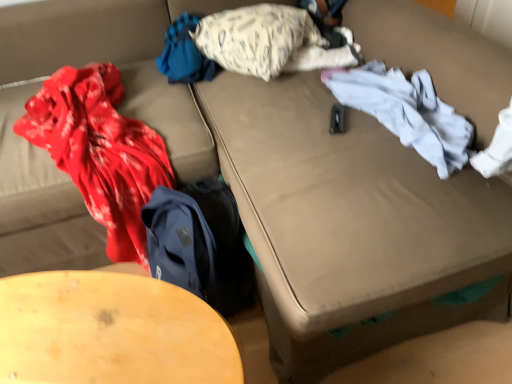
Question: Does wooden table at lower left have a lesser height compared to white textured pillow at upper center?

Choices:
 (A) no
 (B) yes

Answer: (A)

Question: Does wooden table at lower left have a smaller size compared to white textured pillow at upper center?

Choices:
 (A) no
 (B) yes

Answer: (A)

Question: From a real-world perspective, is wooden table at lower left over white textured pillow at upper center?

Choices:
 (A) no
 (B) yes

Answer: (A)

Question: Is wooden table at lower left bigger than white textured pillow at upper center?

Choices:
 (A) no
 (B) yes

Answer: (B)

Question: Is wooden table at lower left thinner than white textured pillow at upper center?

Choices:
 (A) yes
 (B) no

Answer: (A)

Question: Is wooden table at lower left at the right side of white textured pillow at upper center?

Choices:
 (A) no
 (B) yes

Answer: (A)

Question: Can you confirm if blue fabric at upper center, the 1th clothing viewed from the left, is thinner than white cotton shirt at right, which appears as the first clothing when viewed from the right?

Choices:
 (A) no
 (B) yes

Answer: (A)

Question: Considering the relative positions of blue fabric at upper center, the 1th clothing viewed from the left, and white cotton shirt at right, which appears as the first clothing when viewed from the right, in the image provided, is blue fabric at upper center, the 1th clothing viewed from the left, behind white cotton shirt at right, which appears as the first clothing when viewed from the right,?

Choices:
 (A) yes
 (B) no

Answer: (A)

Question: Does blue fabric at upper center, marked as the second clothing in a right-to-left arrangement, lie in front of white cotton shirt at right, which appears as the first clothing when viewed from the right?

Choices:
 (A) no
 (B) yes

Answer: (A)

Question: Can you confirm if blue fabric at upper center, the 1th clothing viewed from the left, is bigger than white cotton shirt at right, which appears as the first clothing when viewed from the right?

Choices:
 (A) no
 (B) yes

Answer: (A)

Question: From a real-world perspective, is blue fabric at upper center, marked as the second clothing in a right-to-left arrangement, on top of white cotton shirt at right, the 2th clothing positioned from the left?

Choices:
 (A) no
 (B) yes

Answer: (B)

Question: Is blue fabric at upper center, the 1th clothing viewed from the left, at the right side of white cotton shirt at right, which appears as the first clothing when viewed from the right?

Choices:
 (A) no
 (B) yes

Answer: (A)

Question: Is white cotton shirt at right, which appears as the first clothing when viewed from the right, facing away from wooden table at lower left?

Choices:
 (A) yes
 (B) no

Answer: (B)